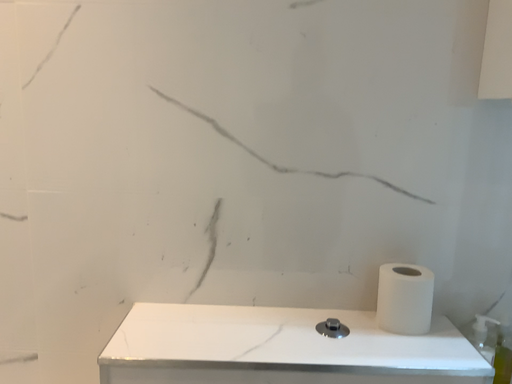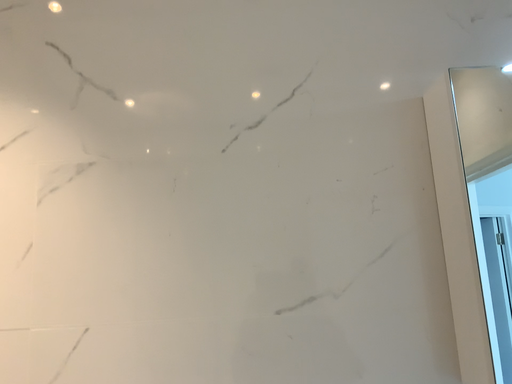
Question: How did the camera likely rotate when shooting the video?

Choices:
 (A) rotated downward
 (B) rotated upward

Answer: (B)